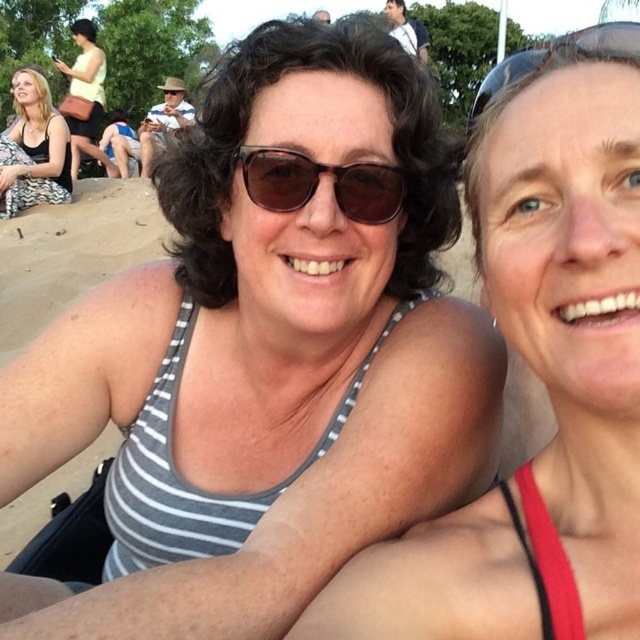
You are a photographer trying to capture a group photo of the gray striped tank top at center and the matte black tank top at lower left. The minimum distance required for your camera to focus properly is 30 feet. Based on the scene, can you take a clear photo of both subjects at the same time?

The gray striped tank top at center and matte black tank top at lower left are 29.08 feet apart from each other. Since the required minimum distance for focus is 30 feet, the camera cannot focus properly on both subjects simultaneously.